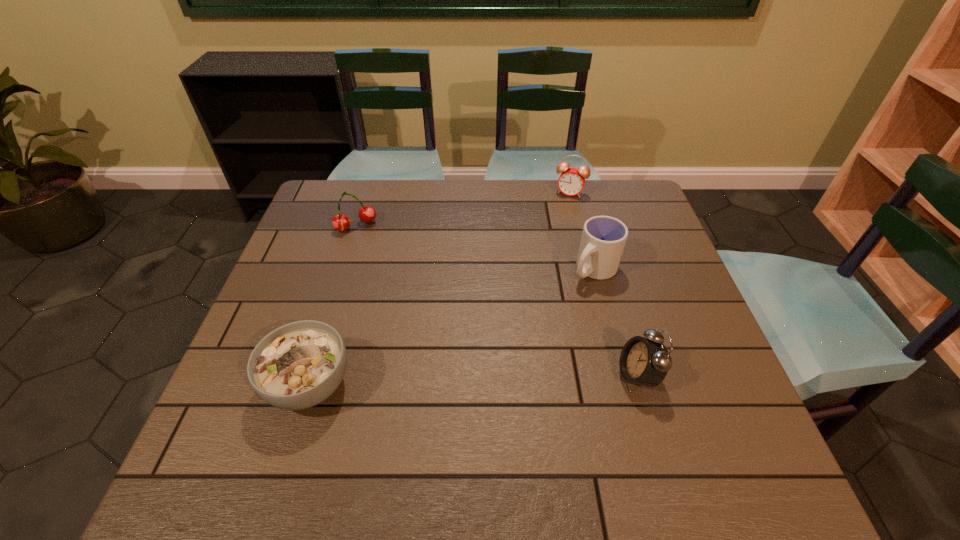
Locate an element on the screen. The image size is (960, 540). free point that satisfies the following two spatial constraints: 1. on the front side of the fourth nearest object; 2. on the right side of the cup is located at coordinates (343, 269).